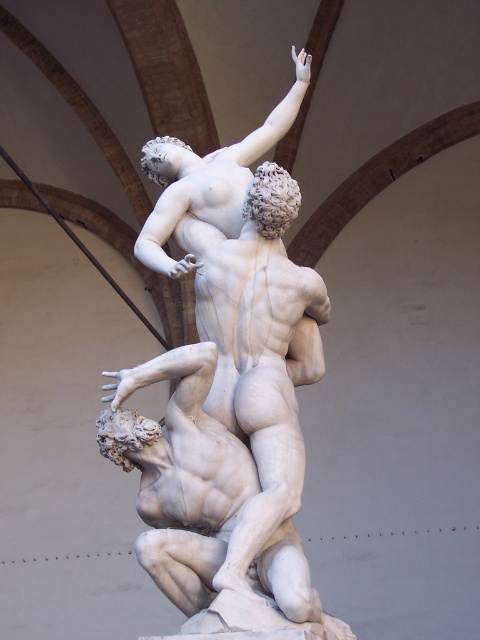
You are an art conservator examining the sculpture. You notice two points of concern on the sculpture, located at coordinates point (256,268) and point (233,500). Which point is closer to you?

Point (256,268) is further to the viewer than point (233,500), so the point closer to you is point (233,500).

You are an art conservator examining the white marble sculpture at center and the white marble statue at center in the image. Which one has a greater width?

The white marble sculpture at center has a greater width than the white marble statue at center.